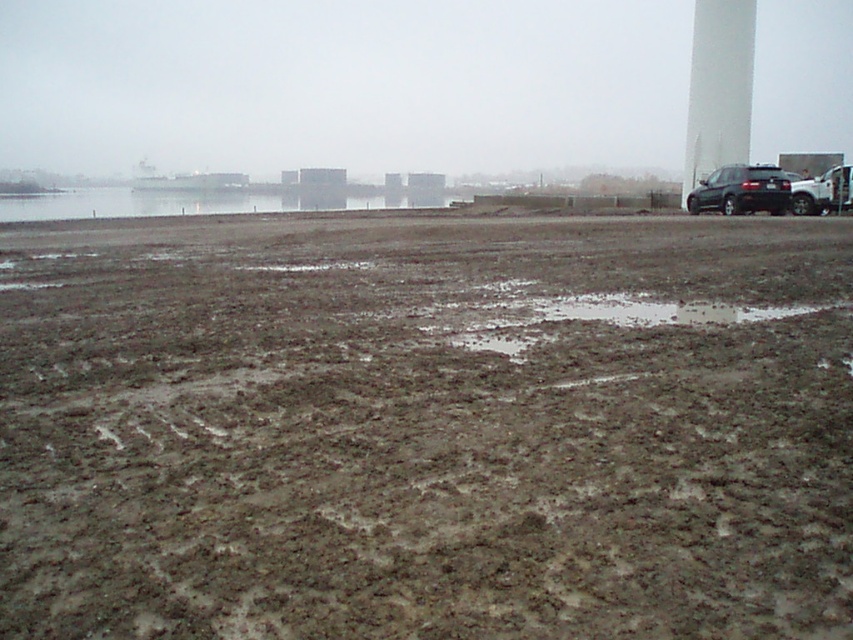
Between muddy wet puddle at center and white smooth water tower at upper right, which one has more height?

Standing taller between the two is white smooth water tower at upper right.

Which is in front, point (547, 296) or point (708, 90)?

Point (547, 296) is in front.

Is point (486, 289) closer to camera compared to point (706, 81)?

Yes, point (486, 289) is closer to viewer.

The image size is (853, 640). In order to click on muddy wet puddle at center in this screenshot , I will do `click(582, 314)`.

Which is behind, point (447, 472) or point (347, 202)?

The point (347, 202) is behind.

Where is `dull brown dirt at center`? The image size is (853, 640). dull brown dirt at center is located at coordinates coord(426,428).

Is white smooth water tower at upper right above black matte truck at right?

Yes, white smooth water tower at upper right is above black matte truck at right.

Which is behind, point (706, 70) or point (807, 192)?

Positioned behind is point (706, 70).

The width and height of the screenshot is (853, 640). I want to click on white smooth water tower at upper right, so click(718, 88).